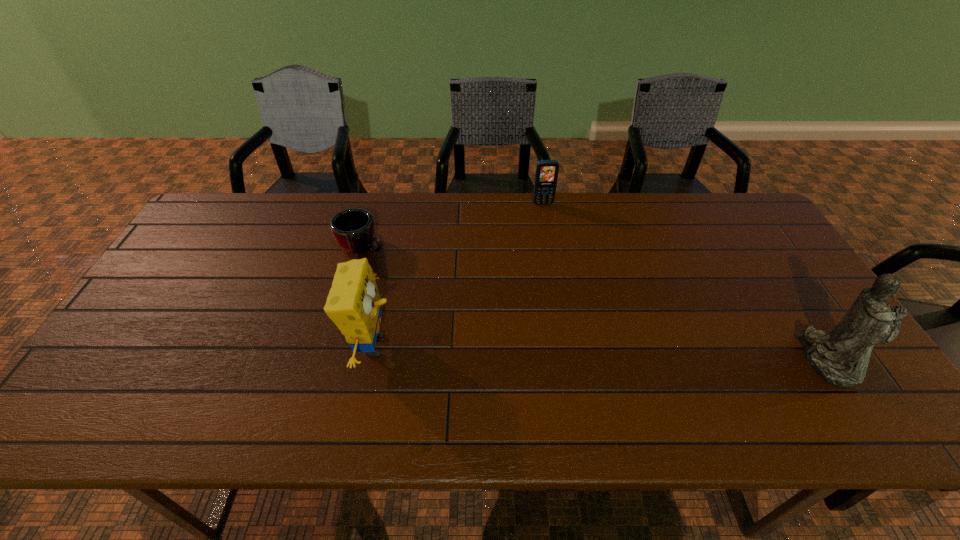
The image size is (960, 540). In order to click on free region at the far edge of the desktop in this screenshot , I will do `click(325, 213)`.

In order to click on free space at the near edge of the desktop in this screenshot , I will do `click(787, 390)`.

Find the location of a particular element. The image size is (960, 540). free space at the right edge of the desktop is located at coordinates (810, 296).

The width and height of the screenshot is (960, 540). In the image, there is a desktop. Identify the location of free space at the far left corner. (240, 208).

Image resolution: width=960 pixels, height=540 pixels. In the image, there is a desktop. Identify the location of vacant space at the near right corner. (866, 393).

Find the location of `vacant area that lies between the second tallest object and the figurine`. vacant area that lies between the second tallest object and the figurine is located at coordinates (600, 353).

This screenshot has height=540, width=960. Find the location of `free space between the sponge and the second shortest object`. free space between the sponge and the second shortest object is located at coordinates (459, 274).

Identify the location of free space between the figurine and the shortest object. (594, 303).

Where is `vacant point located between the rightmost object and the sponge`? vacant point located between the rightmost object and the sponge is located at coordinates (600, 353).

I want to click on empty space that is in between the third object from left to right and the figurine, so click(x=685, y=282).